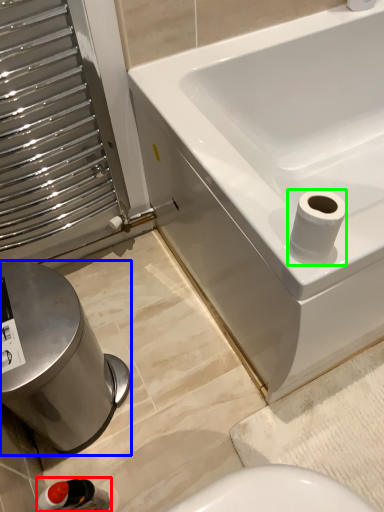
Question: Which is farther away from plumbing fixture (highlighted by a red box)? bidet (highlighted by a blue box) or toilet paper (highlighted by a green box)?

Choices:
 (A) bidet
 (B) toilet paper

Answer: (B)